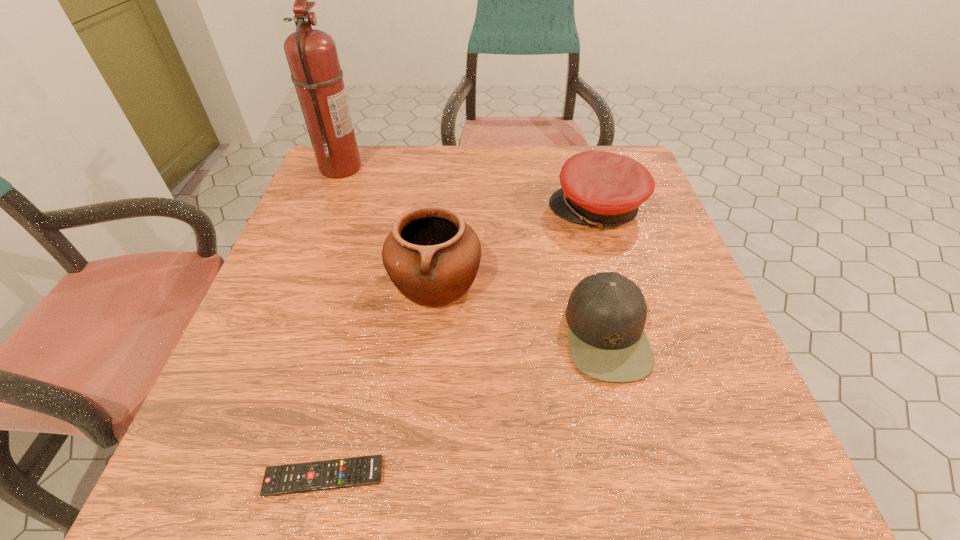
The height and width of the screenshot is (540, 960). What are the coordinates of `remote control positioned at the left edge` in the screenshot? It's located at (339, 473).

What are the coordinates of `object that is at the far left corner` in the screenshot? It's located at (312, 56).

You are a GUI agent. You are given a task and a screenshot of the screen. Output one action in this format:
    pyautogui.click(x=<x>, y=<y>)
    Task: Click on the object at the near left corner
    This screenshot has height=540, width=960.
    Given the screenshot: What is the action you would take?
    pyautogui.click(x=339, y=473)

Where is `object that is at the far right corner`? object that is at the far right corner is located at coordinates (603, 189).

Image resolution: width=960 pixels, height=540 pixels. I want to click on vacant space at the far edge of the desktop, so click(x=397, y=154).

Image resolution: width=960 pixels, height=540 pixels. Identify the location of vacant space at the near edge of the desktop. (312, 461).

Find the location of a particular element. Image resolution: width=960 pixels, height=540 pixels. vacant position at the left edge of the desktop is located at coordinates (239, 358).

At what (x,y) coordinates should I click in order to perform the action: click on vacant space at the right edge. Please return your answer as a coordinate pair (x, y). The width and height of the screenshot is (960, 540). Looking at the image, I should click on (685, 399).

The image size is (960, 540). I want to click on vacant space at the near right corner of the desktop, so click(x=707, y=455).

Image resolution: width=960 pixels, height=540 pixels. I want to click on free space between the pottery and the nearest object, so click(380, 379).